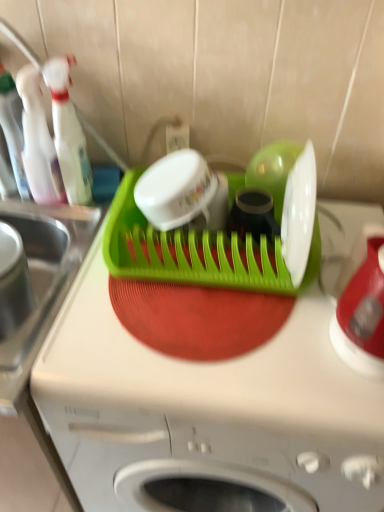
Where is `empty space that is ontop of green plastic dish rack at center (from a real-world perspective)`? The image size is (384, 512). empty space that is ontop of green plastic dish rack at center (from a real-world perspective) is located at coordinates (224, 323).